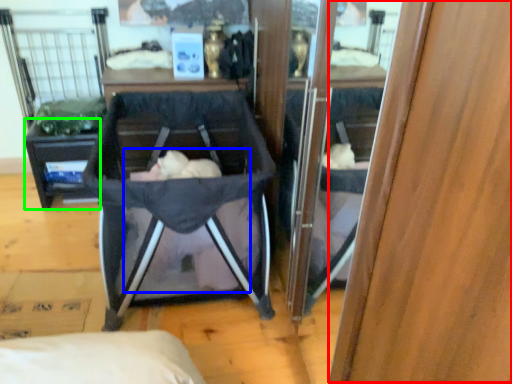
Question: Which object is the farthest from wood (highlighted by a red box)? Choose among these: baby (highlighted by a blue box) or vanity (highlighted by a green box).

Choices:
 (A) baby
 (B) vanity

Answer: (B)